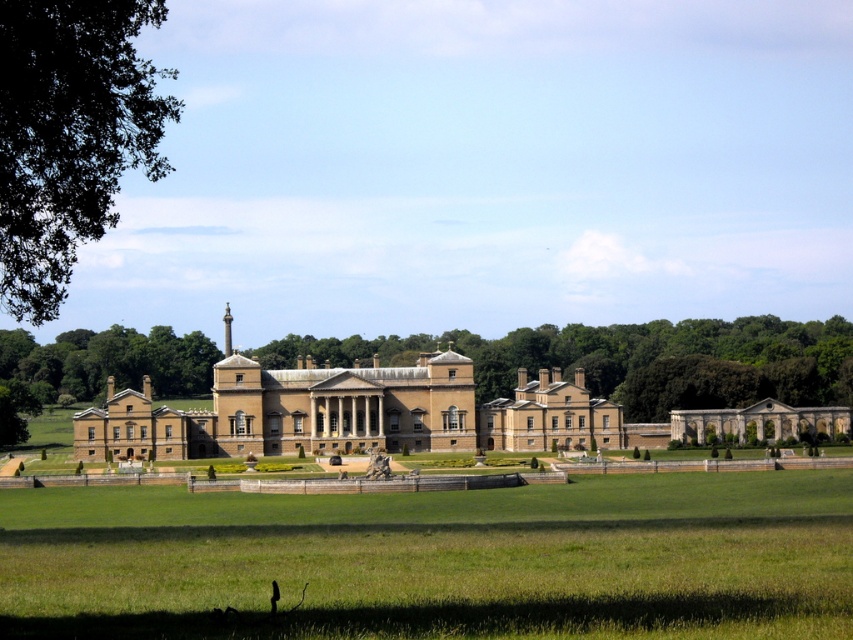
Describe the element at coordinates (438, 561) in the screenshot. The width and height of the screenshot is (853, 640). I see `green grass at center` at that location.

Does green grass at center have a larger size compared to green leafy tree at upper left?

Actually, green grass at center might be smaller than green leafy tree at upper left.

Who is more forward, (625,548) or (28,163)?

Point (28,163) is more forward.

You are a GUI agent. You are given a task and a screenshot of the screen. Output one action in this format:
    pyautogui.click(x=<x>, y=<y>)
    Task: Click on the green grass at center
    Image resolution: width=853 pixels, height=640 pixels.
    Given the screenshot: What is the action you would take?
    pyautogui.click(x=438, y=561)